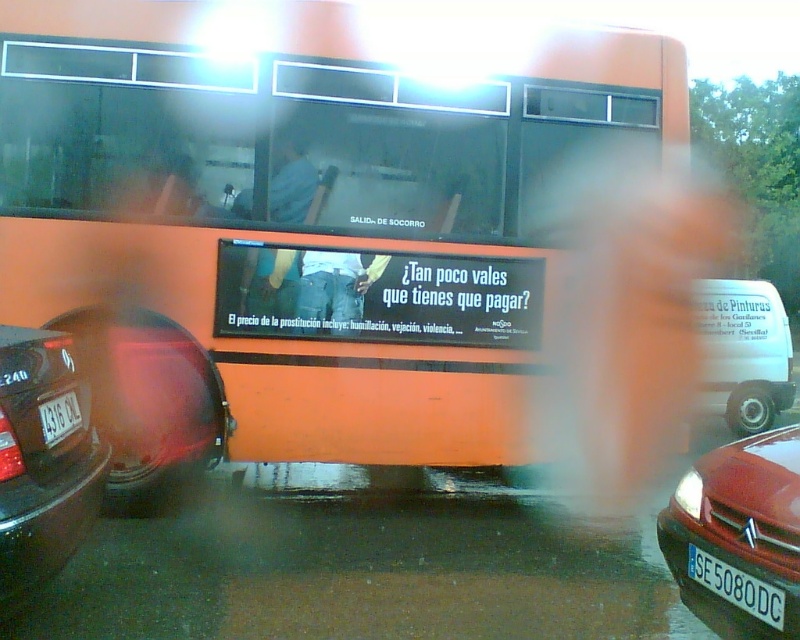
Between white plastic license plate at lower right and white plastic license plate at lower left, which one has less height?

white plastic license plate at lower right

Who is lower down, white plastic license plate at lower right or white plastic license plate at lower left?

white plastic license plate at lower right

Image resolution: width=800 pixels, height=640 pixels. Describe the element at coordinates (736, 586) in the screenshot. I see `white plastic license plate at lower right` at that location.

Where is `white plastic license plate at lower right`? The height and width of the screenshot is (640, 800). white plastic license plate at lower right is located at coordinates (736, 586).

Between shiny red car at lower right and white plastic license plate at lower right, which one has more height?

With more height is shiny red car at lower right.

Between shiny red car at lower right and white plastic license plate at lower right, which one is positioned lower?

white plastic license plate at lower right

Where is `shiny red car at lower right`? This screenshot has height=640, width=800. shiny red car at lower right is located at coordinates coord(738,536).

The width and height of the screenshot is (800, 640). What are the coordinates of `shiny red car at lower right` in the screenshot? It's located at (738, 536).

Which is more to the left, shiny red car at lower right or shiny black car at left?

shiny black car at left

Is point (772, 552) farther from camera compared to point (40, 525)?

Yes, point (772, 552) is behind point (40, 525).

The width and height of the screenshot is (800, 640). What are the coordinates of `shiny red car at lower right` in the screenshot? It's located at (738, 536).